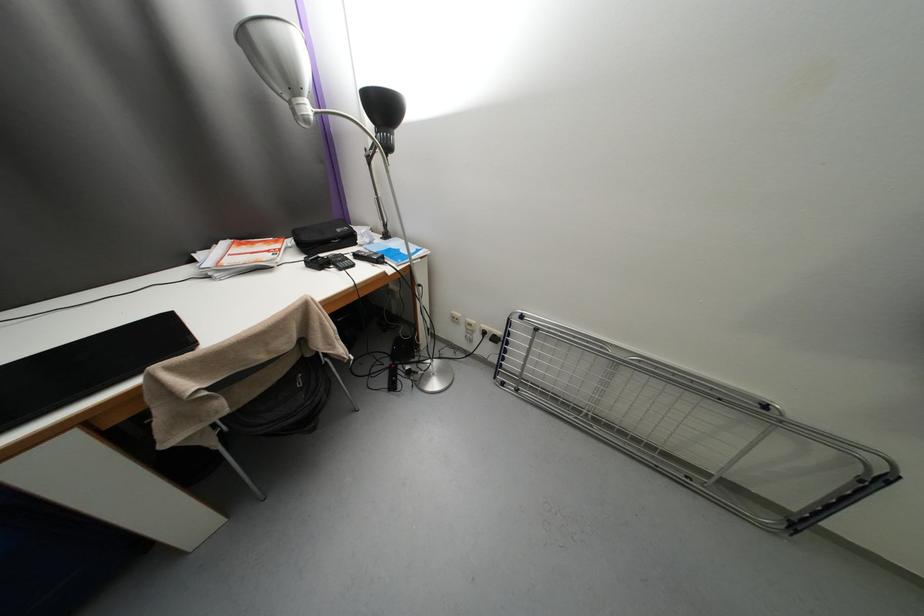
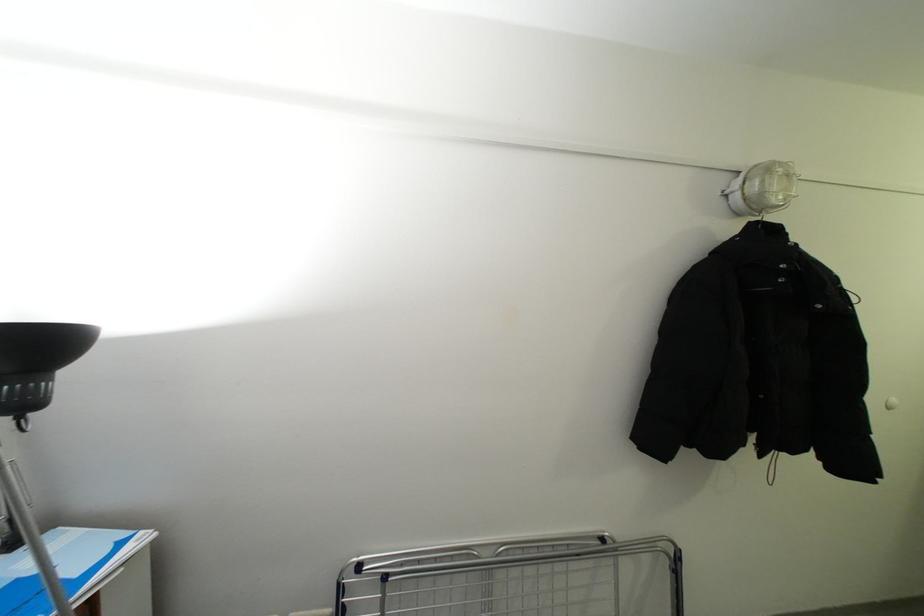
Find the pixel in the second image that matches (x=772, y=408) in the first image.

(609, 541)